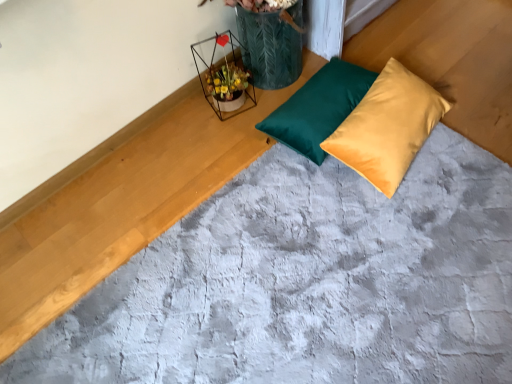
Question: Considering the relative sizes of metallic wire flower basket at upper center and satin yellow pillow at center, the second pillow when ordered from left to right, in the image provided, is metallic wire flower basket at upper center wider than satin yellow pillow at center, the second pillow when ordered from left to right,?

Choices:
 (A) yes
 (B) no

Answer: (B)

Question: From a real-world perspective, is metallic wire flower basket at upper center beneath satin yellow pillow at center, which appears as the 1th pillow when viewed from the right?

Choices:
 (A) no
 (B) yes

Answer: (A)

Question: From a real-world perspective, does metallic wire flower basket at upper center stand above satin yellow pillow at center, the second pillow when ordered from left to right?

Choices:
 (A) yes
 (B) no

Answer: (A)

Question: Is metallic wire flower basket at upper center directly adjacent to satin yellow pillow at center, the second pillow when ordered from left to right?

Choices:
 (A) no
 (B) yes

Answer: (A)

Question: Is there a large distance between metallic wire flower basket at upper center and satin yellow pillow at center, which appears as the 1th pillow when viewed from the right?

Choices:
 (A) yes
 (B) no

Answer: (B)

Question: Can you confirm if metallic wire flower basket at upper center is shorter than satin yellow pillow at center, which appears as the 1th pillow when viewed from the right?

Choices:
 (A) yes
 (B) no

Answer: (B)

Question: From the image's perspective, does teal satin pillow at center, which is the second pillow in right-to-left order, appear lower than satin yellow pillow at center, which appears as the 1th pillow when viewed from the right?

Choices:
 (A) yes
 (B) no

Answer: (B)

Question: Is teal satin pillow at center, marked as the first pillow in a left-to-right arrangement, looking in the opposite direction of satin yellow pillow at center, which appears as the 1th pillow when viewed from the right?

Choices:
 (A) no
 (B) yes

Answer: (A)

Question: From the image's perspective, is teal satin pillow at center, which is the second pillow in right-to-left order, above satin yellow pillow at center, the second pillow when ordered from left to right?

Choices:
 (A) yes
 (B) no

Answer: (A)

Question: Is teal satin pillow at center, marked as the first pillow in a left-to-right arrangement, bigger than satin yellow pillow at center, the second pillow when ordered from left to right?

Choices:
 (A) no
 (B) yes

Answer: (A)

Question: From a real-world perspective, is teal satin pillow at center, which is the second pillow in right-to-left order, physically below satin yellow pillow at center, which appears as the 1th pillow when viewed from the right?

Choices:
 (A) no
 (B) yes

Answer: (B)

Question: Considering the relative sizes of teal satin pillow at center, marked as the first pillow in a left-to-right arrangement, and satin yellow pillow at center, which appears as the 1th pillow when viewed from the right, in the image provided, is teal satin pillow at center, marked as the first pillow in a left-to-right arrangement, thinner than satin yellow pillow at center, which appears as the 1th pillow when viewed from the right,?

Choices:
 (A) no
 (B) yes

Answer: (B)

Question: Is satin yellow pillow at center, the second pillow when ordered from left to right, smaller than metallic wire flower basket at upper center?

Choices:
 (A) no
 (B) yes

Answer: (A)